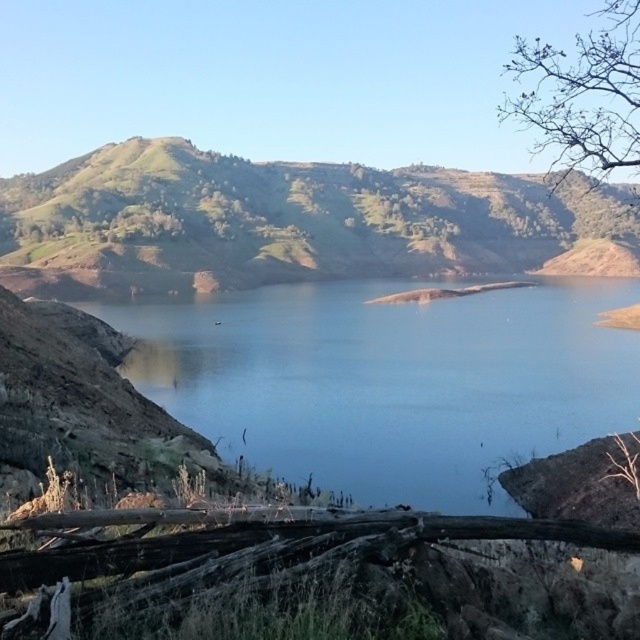
You are standing at the point marked as point (292, 221) in the image. What do you see directly in front of you?

You see a green grassy hill at center directly in front of you at point (292, 221).

You are standing at the edge of the lake and want to walk towards the green grassy hill at center and the bare branches at upper right. Which object will you encounter first as you move forward?

You will encounter the green grassy hill at center first because it is closer to you than the bare branches at upper right, which are further away.

You are a photographer standing at the edge of the lake. You want to capture a closeup shot of the blue water at center. Considering your camera can focus on objects within 20 meters, will you be able to take the photo without moving closer?

The distance between you and the blue water at center is 20.84 meters, which is beyond your camera focus range of 20 meters. Therefore, you cannot take the closeup shot without moving closer.